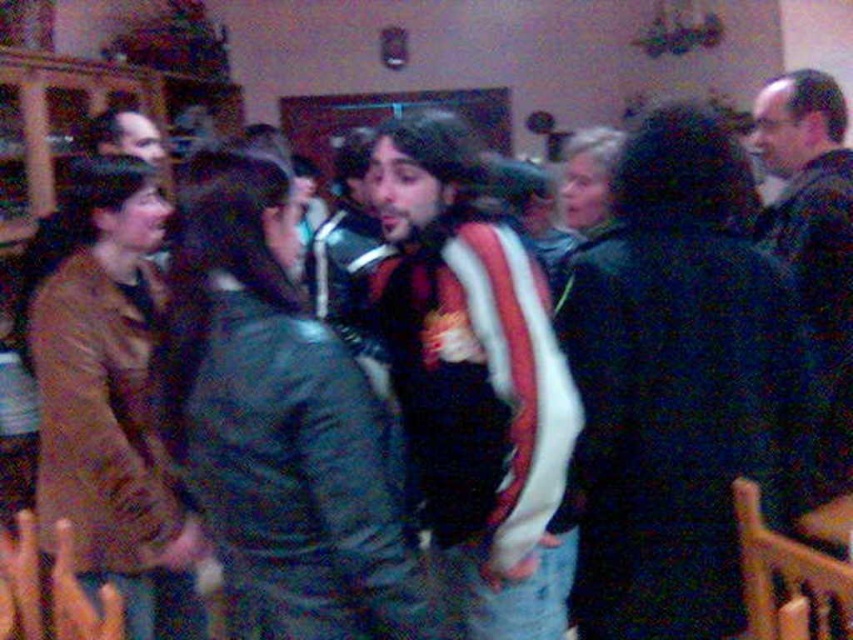
You are a photographer standing in the room. You want to take a clear photo of the striped sweater at center without blurring it. The camera you have requires the subject to be at least 1.5 meters away to avoid motion blur. Can you take the photo from your current position?

The striped sweater at center is only 1.44 meters away from the viewer. Since the camera requires a minimum distance of 1.5 meters to avoid motion blur, the photographer cannot take a clear photo from the current position without risking blur.

You are at a party and want to find the tallest person wearing a sweater. You see a striped sweater at center and a dark green sweater at center. Which sweater is worn by the taller person?

The dark green sweater at center is taller than the striped sweater at center, so the person wearing the dark green sweater at center is taller.

You are at a party and notice two people wearing sweaters. One is wearing a striped sweater at center and the other a dark green sweater at center. Which sweater is positioned to the left?

The striped sweater at center is to the left of the dark green sweater at center.